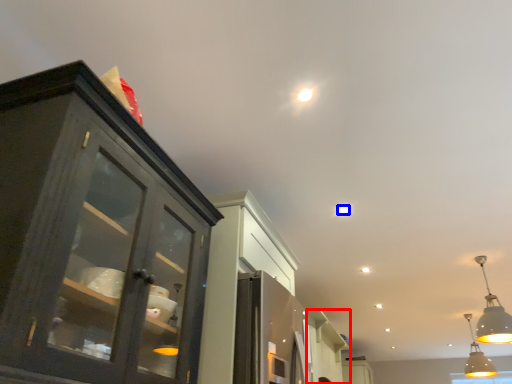
Question: Among these objects, which one is nearest to the camera, cabinetry (highlighted by a red box) or light (highlighted by a blue box)?

Choices:
 (A) cabinetry
 (B) light

Answer: (B)